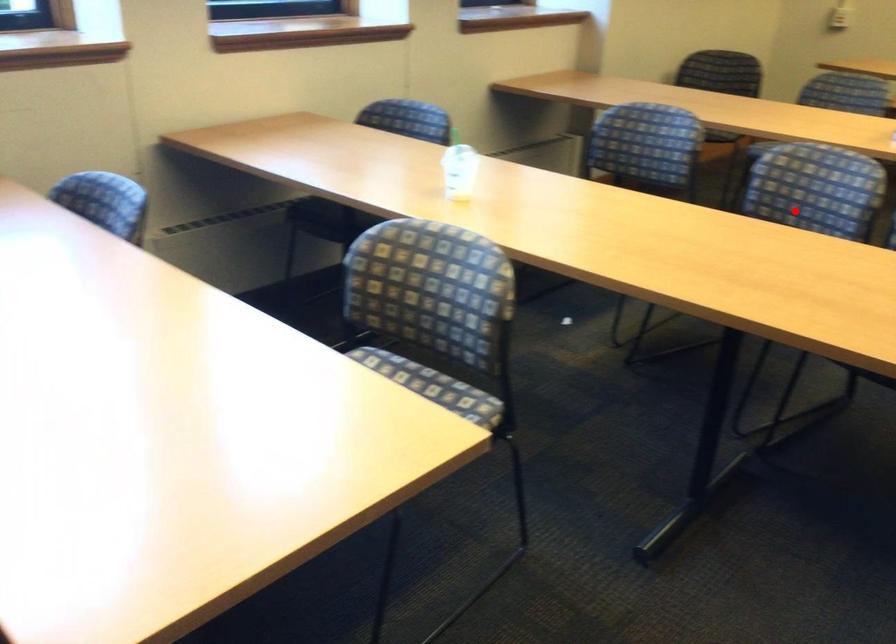
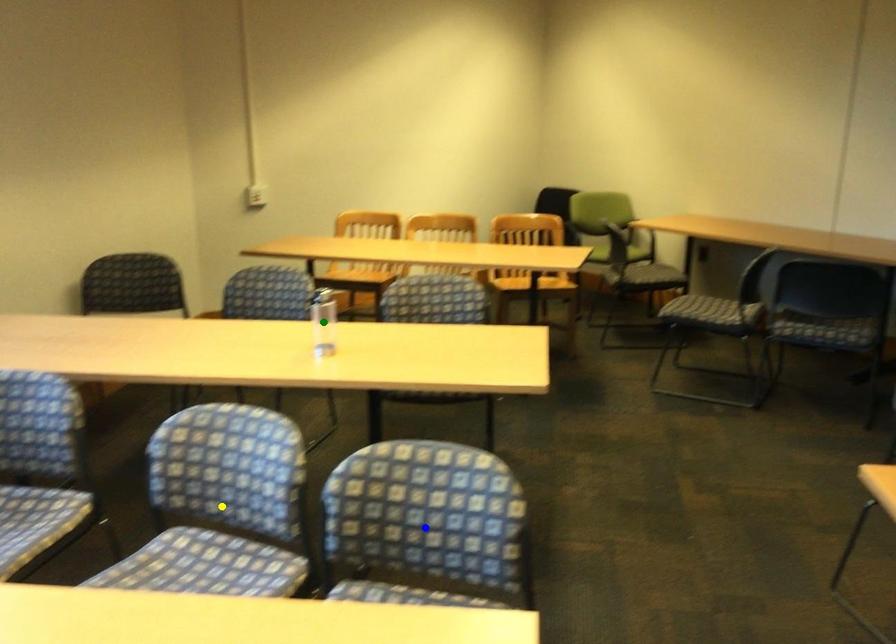
Question: I am providing you with two images of the same scene from different viewpoints. A red point is marked on the first image. You are given multiple points on the second image. Which spot in image 2 lines up with the point in image 1?

Choices:
 (A) blue point
 (B) green point
 (C) yellow point

Answer: (C)